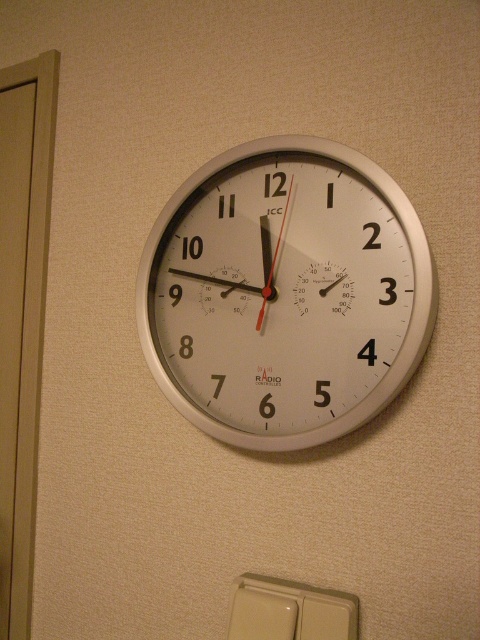
You are trying to reach the beige plastic light switch at lower center to turn on the lights. The white metallic clock at center is in your way. Can you reach the light switch without moving the clock?

The white metallic clock at center is taller than beige plastic light switch at lower center. Since the clock is taller, it might block your access to the light switch. You may need to move the clock or find another way to reach the switch.

You are trying to reach the beige plastic light switch at lower center to turn on the lights, but there is a white metallic clock at center in the way. Can you move the clock to access the switch?

The white metallic clock at center is positioned over the beige plastic light switch at lower center, so you cannot directly access the switch without moving the clock first.

You are standing in a room with a beige wall and want to hang a picture frame that is 1 meter wide. The frame must be centered exactly where the white metallic clock at center is currently hanging. Since the clock is only 30 cm wide, how much space will remain on either side of the clock within the frame?

The white metallic clock at center is located at point coordinates (285, 292). The frame is 1 meter wide and the clock is 30 cm wide, so the remaining space on either side would be 35 cm each.